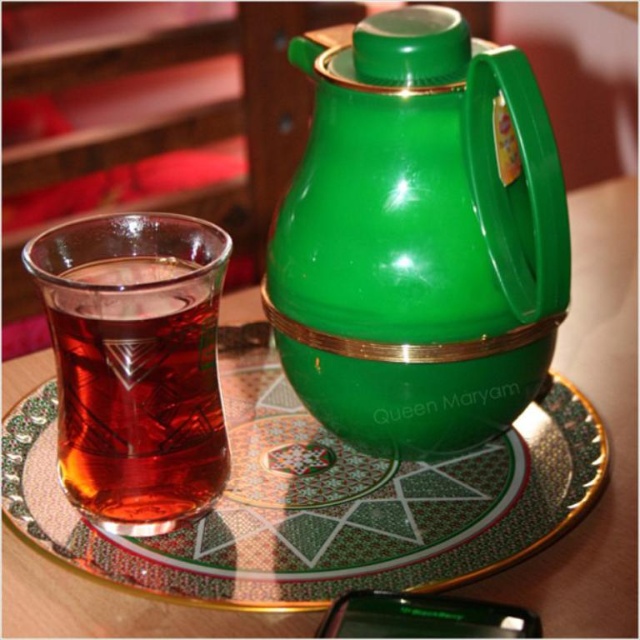
Question: Is green glossy thermos at center below green glossy plate at center?

Choices:
 (A) no
 (B) yes

Answer: (A)

Question: From the image, what is the correct spatial relationship of green glossy plate at center in relation to translucent glass cup at left?

Choices:
 (A) above
 (B) below

Answer: (B)

Question: Among these objects, which one is nearest to the camera?

Choices:
 (A) translucent glass cup at left
 (B) green glossy thermos at center

Answer: (A)

Question: Considering the relative positions of green glossy thermos at center and translucent glass cup at left in the image provided, where is green glossy thermos at center located with respect to translucent glass cup at left?

Choices:
 (A) left
 (B) right

Answer: (B)

Question: Which object is farther from the camera taking this photo?

Choices:
 (A) green glossy plate at center
 (B) translucent glass cup at left

Answer: (A)

Question: Estimate the real-world distances between objects in this image. Which object is farther from the green glossy thermos at center?

Choices:
 (A) translucent glass cup at left
 (B) green glossy plate at center

Answer: (A)